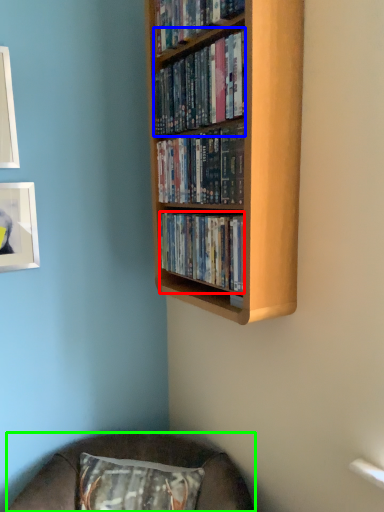
Question: Which is farther away from book (highlighted by a red box)? book (highlighted by a blue box) or furniture (highlighted by a green box)?

Choices:
 (A) book
 (B) furniture

Answer: (B)